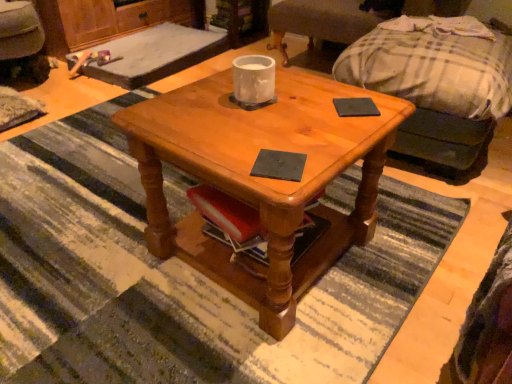
Locate an element on the screen. The height and width of the screenshot is (384, 512). free space to the back side of black matte pad at center, the second pad in the front-to-back sequence is located at coordinates (332, 88).